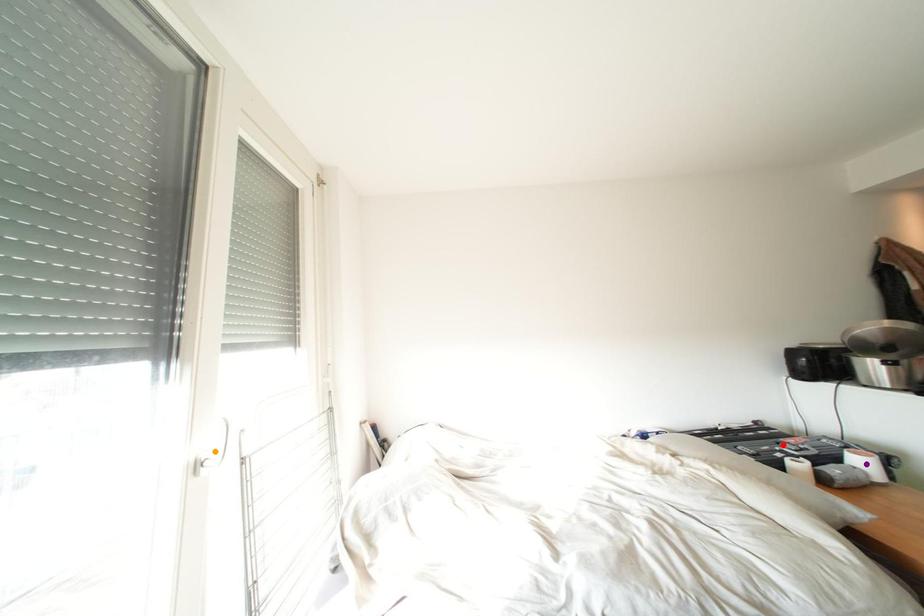
Order these from farthest to nearest:
1. red point
2. orange point
3. purple point

1. red point
2. purple point
3. orange point